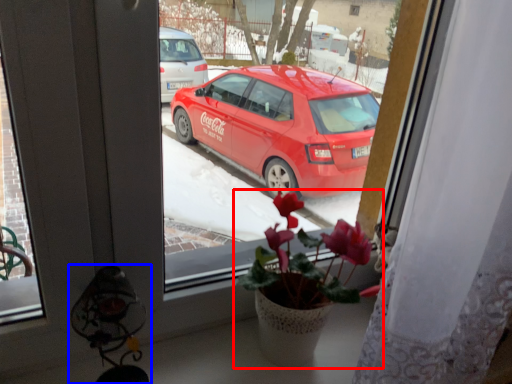
Question: Among these objects, which one is nearest to the camera, houseplant (highlighted by a red box) or lamp (highlighted by a blue box)?

Choices:
 (A) houseplant
 (B) lamp

Answer: (B)